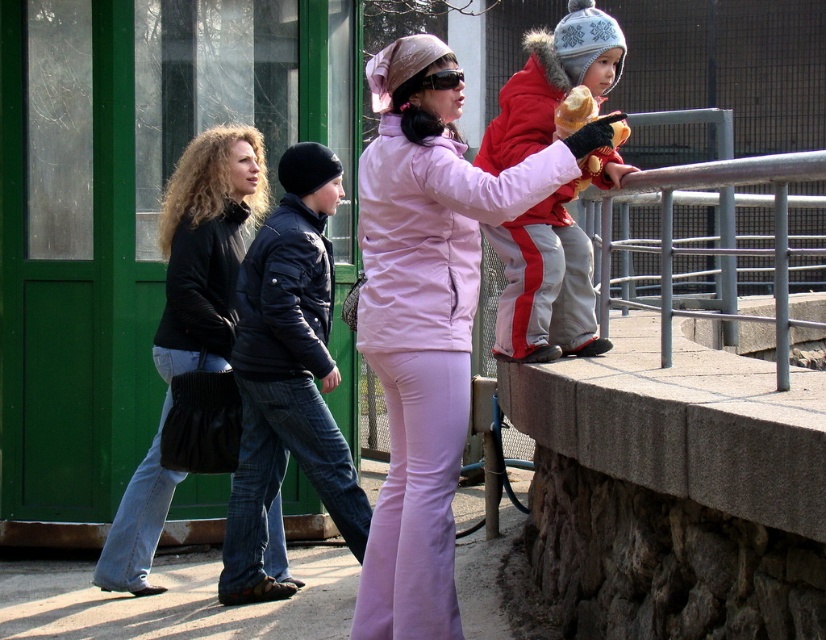
Question: In this image, where is pink matte jacket at center located relative to matte black jacket at left?

Choices:
 (A) left
 (B) right

Answer: (B)

Question: Is matte black jacket at left to the left of matte yellow ice cream cone at upper right from the viewer's perspective?

Choices:
 (A) no
 (B) yes

Answer: (B)

Question: Which object appears closest to the camera in this image?

Choices:
 (A) matte yellow ice cream cone at upper right
 (B) matte black jacket at left
 (C) red fleece jacket at upper right
 (D) pink matte jacket at center

Answer: (D)

Question: Estimate the real-world distances between objects in this image. Which object is closer to the pink matte jacket at center?

Choices:
 (A) black quilted jacket at center
 (B) red fleece jacket at upper right
 (C) matte yellow ice cream cone at upper right

Answer: (C)

Question: Which point is farther to the camera?

Choices:
 (A) matte black jacket at left
 (B) pink matte jacket at center

Answer: (A)

Question: Where is pink matte jacket at center located in relation to matte black jacket at left in the image?

Choices:
 (A) left
 (B) right

Answer: (B)